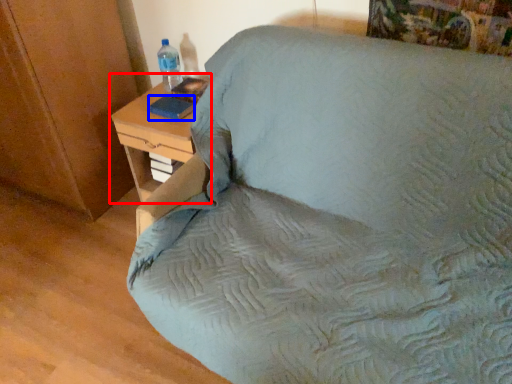
Question: Which object appears farthest to the camera in this image, nightstand (highlighted by a red box) or pad (highlighted by a blue box)?

Choices:
 (A) nightstand
 (B) pad

Answer: (B)